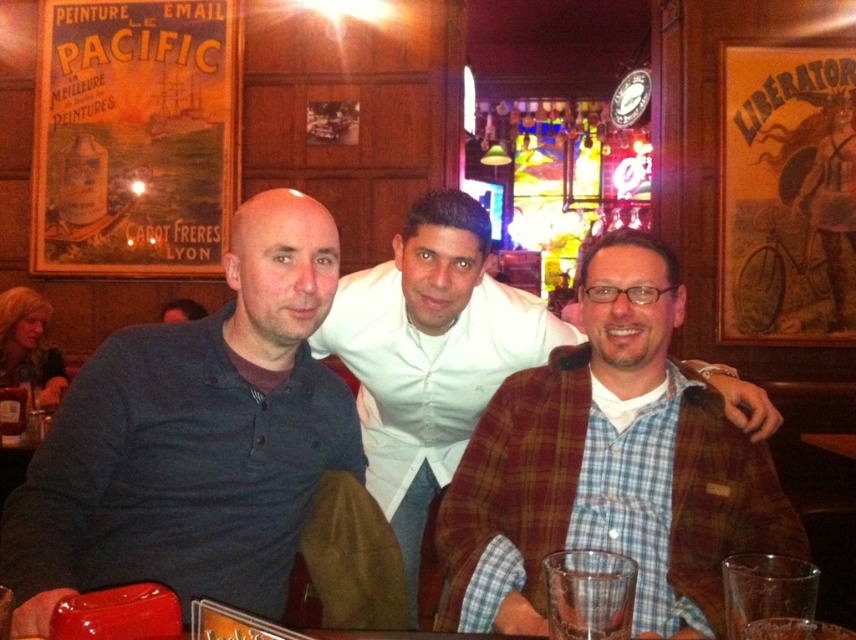
You are a photographer trying to capture a candid shot of the dark blue shirt at left and the plaid wool jacket at center. Since you want to ensure both subjects are in the frame, can you determine which direction you should position your camera relative to the group?

The dark blue shirt at left is to the left of the plaid wool jacket at center, so positioning the camera to the left side of the group will ensure both subjects are captured in the frame.

You are a photographer trying to capture a group photo of the dark blue shirt at left and the plaid wool jacket at center. Since you want everyone to be visible, which person should you position closer to the camera to account for their height difference?

The dark blue shirt at left is much taller than the plaid wool jacket at center, so you should position the plaid wool jacket at center closer to the camera to ensure both are visible in the photo.